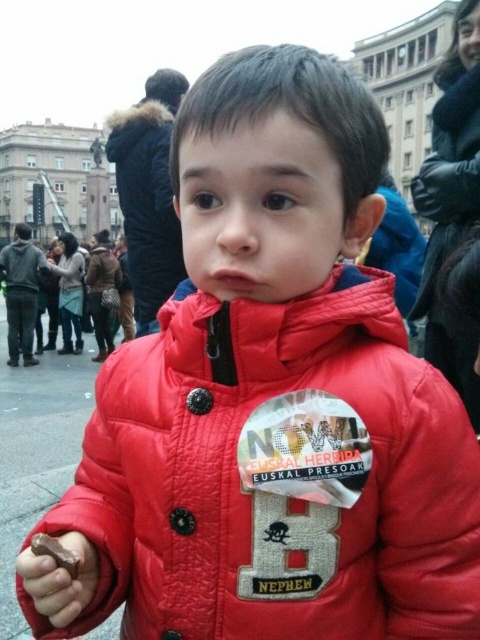
Can you confirm if leather brown jacket at center is shorter than chocolate matte at lower left?

No.

How far apart are leather brown jacket at center and chocolate matte at lower left?

A distance of 54.11 meters exists between leather brown jacket at center and chocolate matte at lower left.

The image size is (480, 640). What do you see at coordinates (103, 269) in the screenshot?
I see `leather brown jacket at center` at bounding box center [103, 269].

This screenshot has width=480, height=640. Find the location of `leather brown jacket at center`. leather brown jacket at center is located at coordinates (103, 269).

Can you confirm if matte black jacket at upper center is positioned below chocolate matte at lower left?

Incorrect, matte black jacket at upper center is not positioned below chocolate matte at lower left.

Is matte black jacket at upper center further to the viewer compared to chocolate matte at lower left?

Yes, it is.

Is point (154, 136) closer to viewer compared to point (48, 556)?

No, it is not.

The height and width of the screenshot is (640, 480). In order to click on matte black jacket at upper center in this screenshot , I will do `click(146, 205)`.

What do you see at coordinates (60, 579) in the screenshot? I see `brown matte chocolate at lower left` at bounding box center [60, 579].

Does brown matte chocolate at lower left appear on the right side of leather brown jacket at center?

Indeed, brown matte chocolate at lower left is positioned on the right side of leather brown jacket at center.

I want to click on brown matte chocolate at lower left, so click(x=60, y=579).